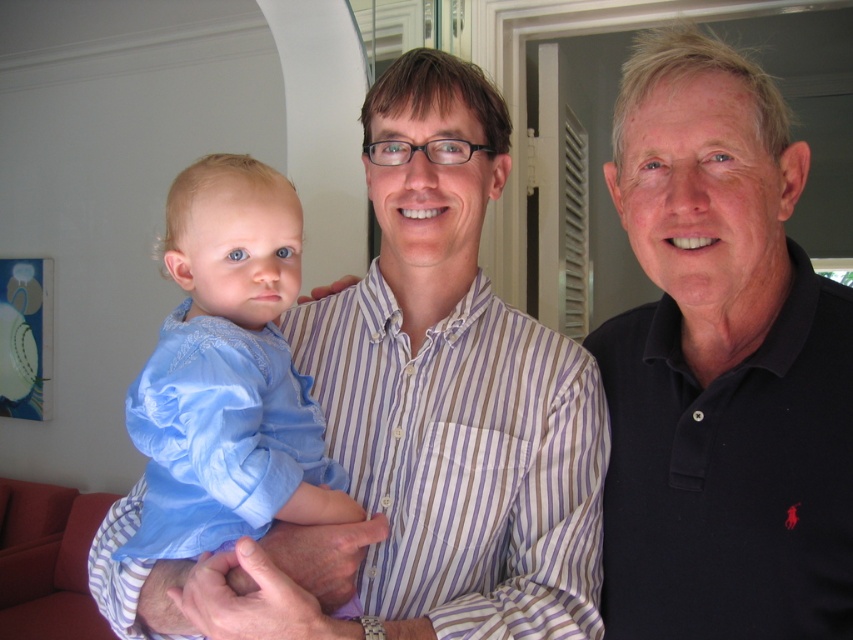
You are a fashion designer observing the image. You need to determine which piece of clothing is taller between the dark blue polo shirt at right and the silky blue shirt at center. Which one is taller?

The dark blue polo shirt at right is taller than the silky blue shirt at center according to the description.

You are organizing a charity clothing drive and need to categorize clothes by size. You have two shirts to sort out. The dark blue polo shirt at right and the silky blue shirt at center. Which shirt should you place in the large size bin?

The dark blue polo shirt at right is bigger than the silky blue shirt at center, so it should be placed in the large size bin.